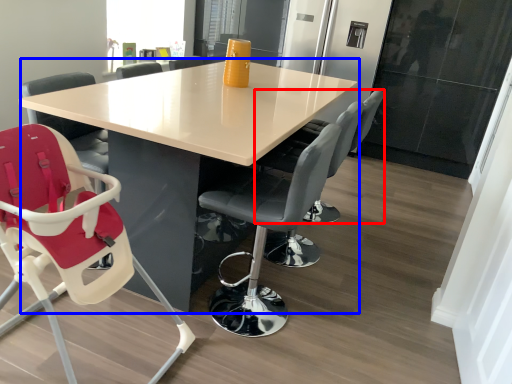
Question: Which object appears farthest to the camera in this image, chair (highlighted by a red box) or table (highlighted by a blue box)?

Choices:
 (A) chair
 (B) table

Answer: (A)